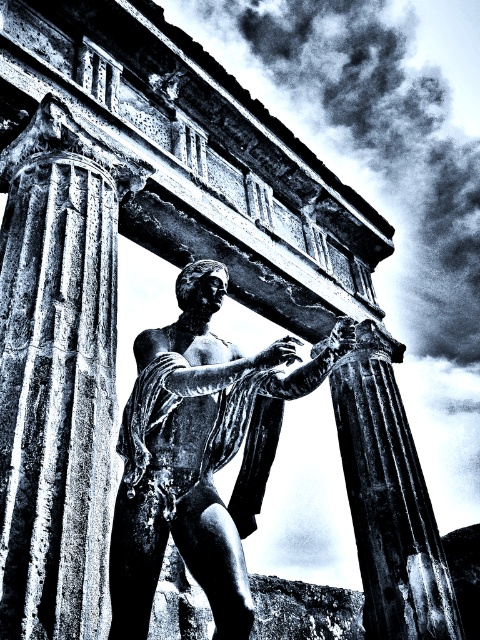
You are an archaeologist examining the statue between the columns. You notice two points marked on your map at coordinates point (145, 352) and point (397, 458). Which point is nearer to you as you stand in front of the statue?

Point (145, 352) is closer to the viewer than point (397, 458), so the point (145, 352) is nearer to you.

You are an art conservator examining the statue and column. You need to move a protective cover from the polished bronze statue at center to the smooth stone column at left. Which direction should you move the cover?

The smooth stone column at left is to the left of the polished bronze statue at center, so you should move the protective cover to the left.

You are an archaeologist examining the ancient structure. You notice two columns, the smooth stone column at left and the smooth stone column at center. Which one is nearer to your current position?

The smooth stone column at left is closer to the viewer than the smooth stone column at center, so the smooth stone column at left is nearer to your current position.